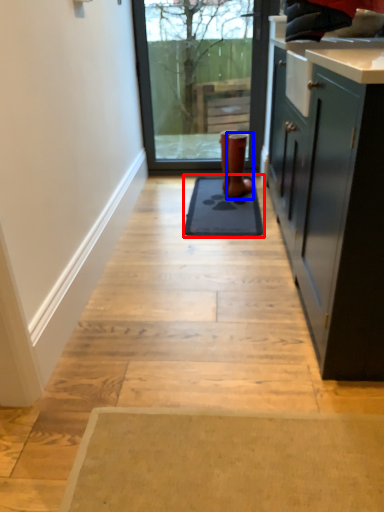
Question: Which of the following is the closest to the observer, mat (highlighted by a red box) or footwear (highlighted by a blue box)?

Choices:
 (A) mat
 (B) footwear

Answer: (A)